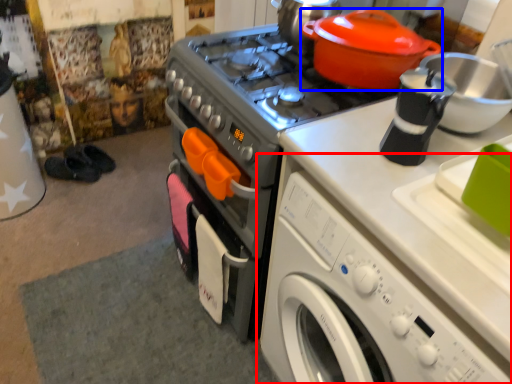
Question: Which object appears closest to the camera in this image, washing machine (highlighted by a red box) or kitchen appliance (highlighted by a blue box)?

Choices:
 (A) washing machine
 (B) kitchen appliance

Answer: (A)